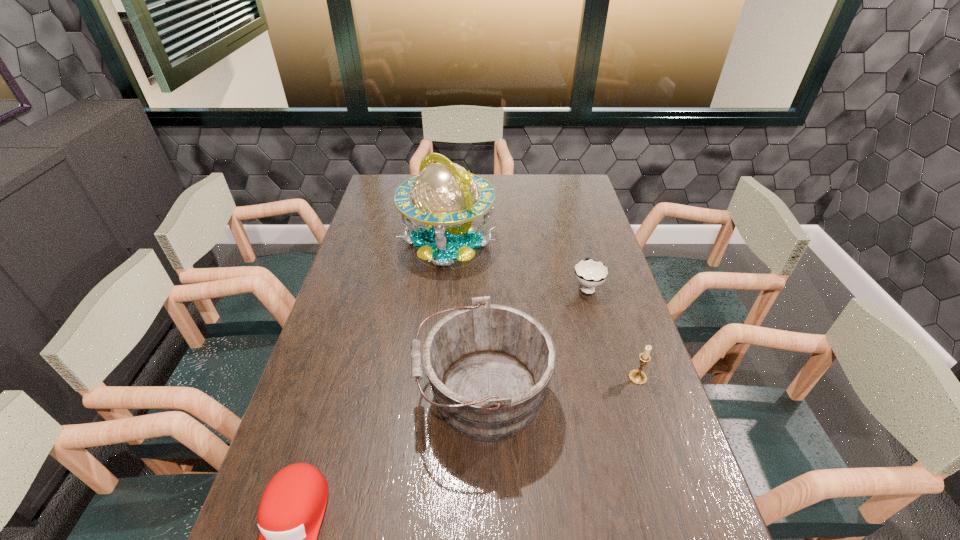
You are a GUI agent. You are given a task and a screenshot of the screen. Output one action in this format:
    pyautogui.click(x=<x>, y=<y>)
    Task: Click on the candle holder present at the right edge
    The height and width of the screenshot is (540, 960).
    Given the screenshot: What is the action you would take?
    pyautogui.click(x=638, y=377)

You are a GUI agent. You are given a task and a screenshot of the screen. Output one action in this format:
    pyautogui.click(x=<x>, y=<y>)
    Task: Click on the cup positioned at the right edge
    This screenshot has width=960, height=540.
    Given the screenshot: What is the action you would take?
    pyautogui.click(x=589, y=273)

Where is `free region at the left edge of the desktop`? The width and height of the screenshot is (960, 540). free region at the left edge of the desktop is located at coordinates (368, 292).

Image resolution: width=960 pixels, height=540 pixels. I want to click on vacant space at the right edge of the desktop, so click(x=664, y=499).

Where is `vacant position at the far left corner of the desktop`? This screenshot has width=960, height=540. vacant position at the far left corner of the desktop is located at coordinates (374, 193).

Locate an element on the screen. vacant point located between the third tallest object and the tallest object is located at coordinates (542, 310).

Image resolution: width=960 pixels, height=540 pixels. What are the coordinates of `empty location between the candle holder and the wine bucket` in the screenshot? It's located at (560, 386).

You are a GUI agent. You are given a task and a screenshot of the screen. Output one action in this format:
    pyautogui.click(x=<x>, y=<y>)
    Task: Click on the free space between the tallest object and the cup
    This screenshot has width=960, height=540.
    Given the screenshot: What is the action you would take?
    pyautogui.click(x=517, y=265)

Image resolution: width=960 pixels, height=540 pixels. I want to click on vacant area that lies between the globe and the third shortest object, so click(x=542, y=310).

At what (x,y) coordinates should I click in order to perform the action: click on vacant space in between the third tallest object and the second tallest object. Please return your answer as a coordinate pair (x, y). The width and height of the screenshot is (960, 540). Looking at the image, I should click on (560, 386).